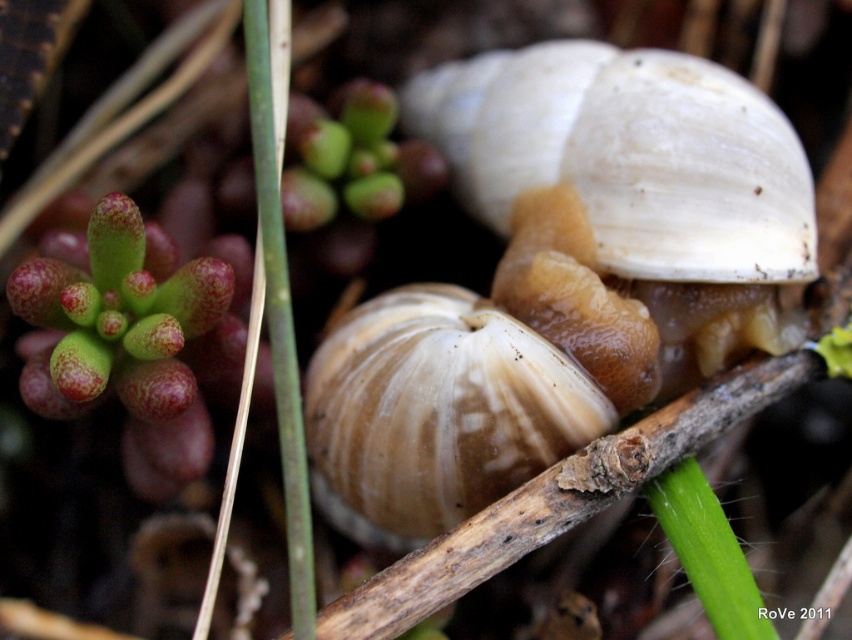
You are a photographer aiming to capture a close detail shot of the matte brown shell at center without the white matte snail at center blocking it. Based on their positions, is this possible?

The matte brown shell at center is behind the white matte snail at center, so it is currently blocked by the snail. To capture the shell without obstruction, you would need to adjust the camera angle or move the snail.

You are a photographer focusing on the two snails in the image. You want to adjust your lens to focus on the point closer to you. Which point should you choose between point (712, 164) and point (464, 396)?

Point (712, 164) is further to the viewer than point (464, 396), so you should choose point (712, 164) as it is closer to you.

You are a photographer focusing on the white matte snail at center and the matte brown shell at center. Which object is closer to the camera lens?

The white matte snail at center is closer to the camera lens because it is located above the matte brown shell at center, which is further away.